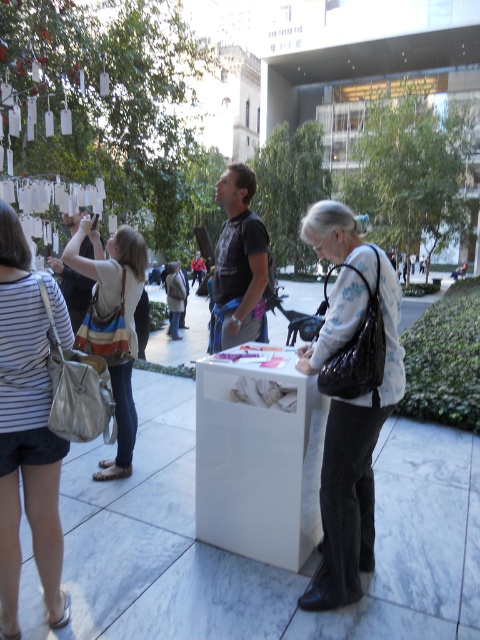
You are organizing a purse exhibition and need to arrange the matte black purse at center and the striped fabric purse at left on a shelf. Which purse should be placed on the lower shelf to ensure they are displayed properly according to their sizes?

The matte black purse at center has a lesser height compared to the striped fabric purse at left, so it should be placed on the lower shelf to accommodate their sizes properly.

You are a security guard at the courtyard and need to check the purses of visitors. You see a matte black purse at center and a striped fabric purse at left. Which purse should you check first if you want to check the smaller one first?

The matte black purse at center is smaller than the striped fabric purse at left, so you should check the matte black purse at center first.